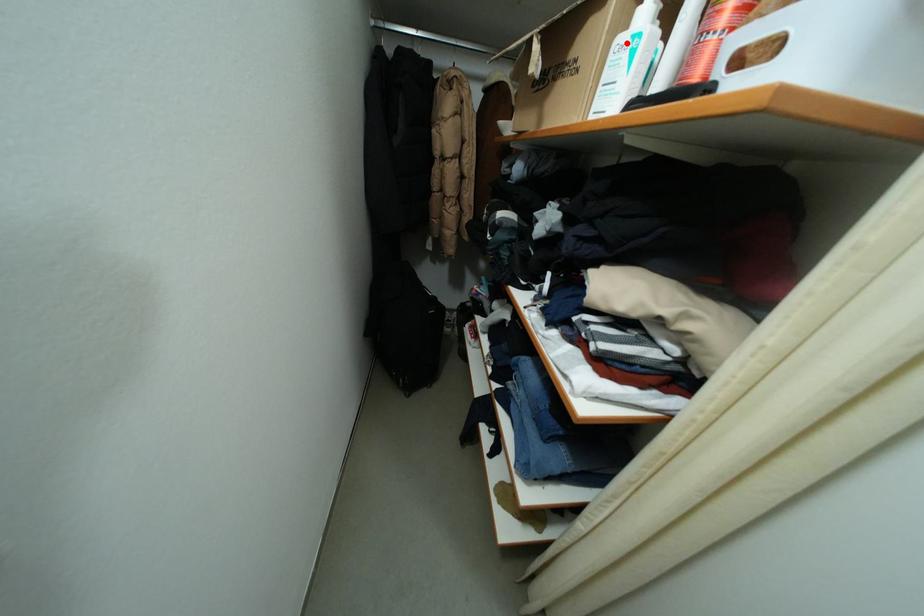
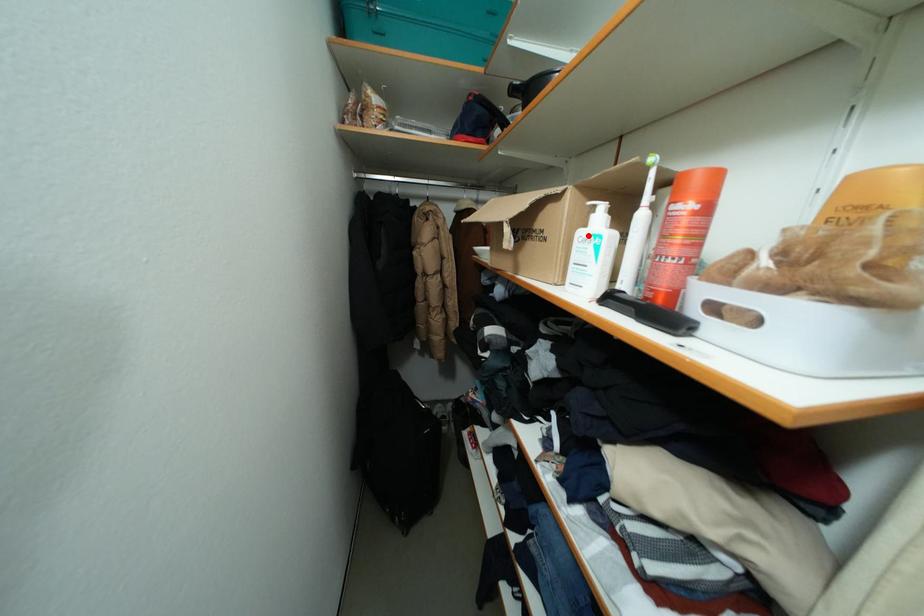
I am providing you with two images of the same scene from different viewpoints. A red point is marked on the first image and another point is marked on the second image. Is the red point in image1 aligned with the point shown in image2?

Yes